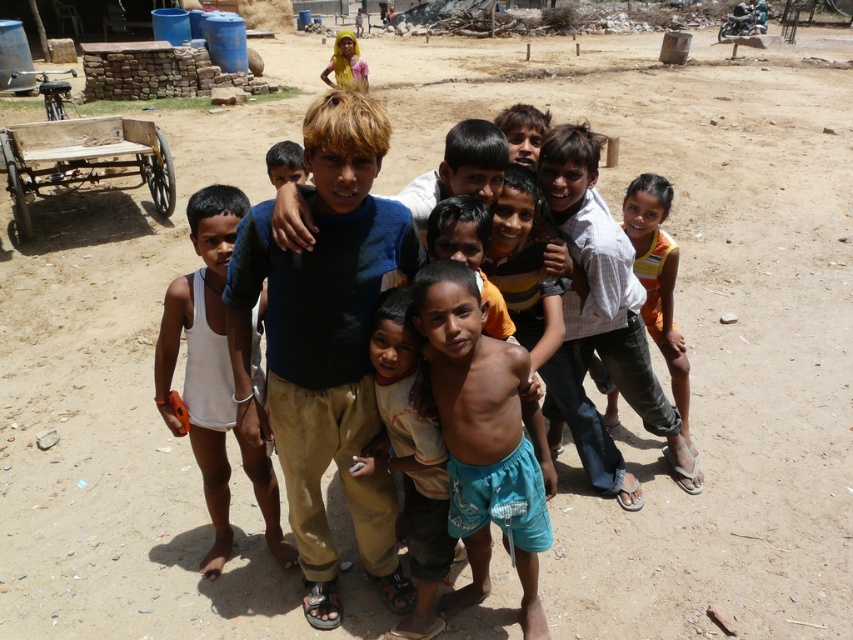
Question: Estimate the real-world distances between objects in this image. Which object is closer to the blue cotton shirt at center?

Choices:
 (A) white cotton tank top at left
 (B) orange sleeveless top at right
 (C) light brown cotton shirt at center

Answer: (C)

Question: Which object appears closest to the camera in this image?

Choices:
 (A) light brown cotton shirt at center
 (B) white cotton tank top at left

Answer: (A)

Question: Is light brown cotton shirt at center positioned at the back of orange sleeveless top at right?

Choices:
 (A) no
 (B) yes

Answer: (A)

Question: Which of these objects is positioned farthest from the white cotton tank top at left?

Choices:
 (A) orange sleeveless top at right
 (B) blue cotton shorts at center

Answer: (A)

Question: Is blue cotton shirt at center thinner than light brown cotton shirt at center?

Choices:
 (A) yes
 (B) no

Answer: (B)

Question: Does blue cotton shirt at center have a smaller size compared to white cotton tank top at left?

Choices:
 (A) no
 (B) yes

Answer: (A)